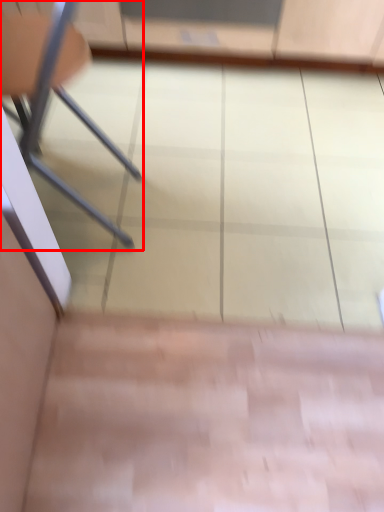
Question: Where is chair (annotated by the red box) located in relation to screen door in the image?

Choices:
 (A) left
 (B) right

Answer: (A)